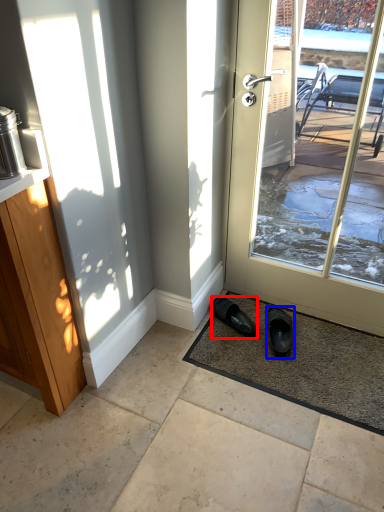
Question: Among these objects, which one is farthest to the camera, footwear (highlighted by a red box) or footwear (highlighted by a blue box)?

Choices:
 (A) footwear
 (B) footwear

Answer: (A)